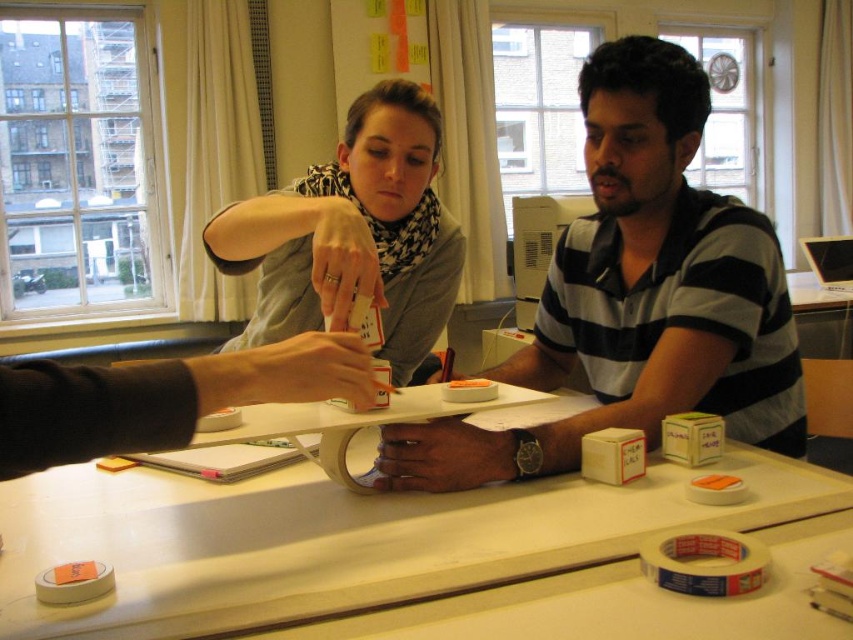
Question: Based on their relative distances, which object is nearer to the striped cotton polo shirt at center?

Choices:
 (A) matte black scarf at upper center
 (B) white matte table at center

Answer: (B)

Question: Can you confirm if white matte table at center is positioned above striped cotton polo shirt at center?

Choices:
 (A) yes
 (B) no

Answer: (B)

Question: Can you confirm if white matte table at center is wider than striped cotton polo shirt at center?

Choices:
 (A) no
 (B) yes

Answer: (B)

Question: Considering the real-world distances, which object is farthest from the striped cotton polo shirt at center?

Choices:
 (A) white matte table at center
 (B) matte black scarf at upper center

Answer: (B)

Question: Can you confirm if striped cotton polo shirt at center is wider than matte black scarf at upper center?

Choices:
 (A) yes
 (B) no

Answer: (A)

Question: Estimate the real-world distances between objects in this image. Which object is farther from the matte black scarf at upper center?

Choices:
 (A) white matte table at center
 (B) striped cotton polo shirt at center

Answer: (A)